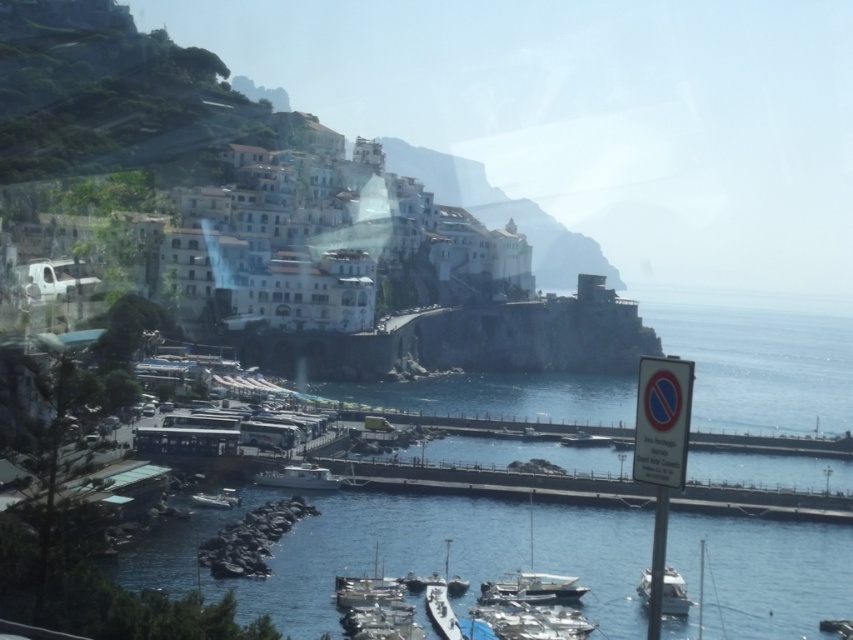
You are a marine biologist who needs to board a vessel for a research trip. You see the white glossy sailboat at lower center and the white glossy boat at center. Which one has a larger deck area for equipment storage?

The white glossy sailboat at lower center might be wider than white glossy boat at center, so it likely has a larger deck area for equipment storage.

You are a photographer trying to capture a wide shot of the harbor. You notice the white glossy sailboat at lower center and the white glossy boat at lower right. Which boat should you focus on to ensure it fits entirely within your camera frame if your current lens can only accommodate wider objects?

The white glossy boat at lower right is wider than the white glossy sailboat at lower center, so focusing on the white glossy boat at lower right will ensure it fits within the camera frame since it is wider and matches the lens capability.

You are standing at the point marked as point (532, 582). Which object is exactly at your current location?

The white glossy sailboat at lower center is exactly at point (532, 582).